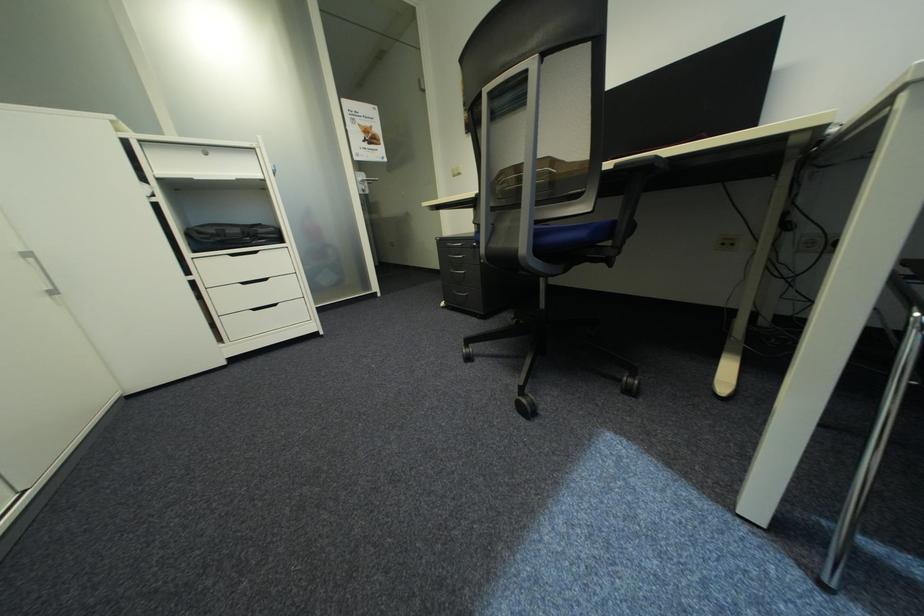
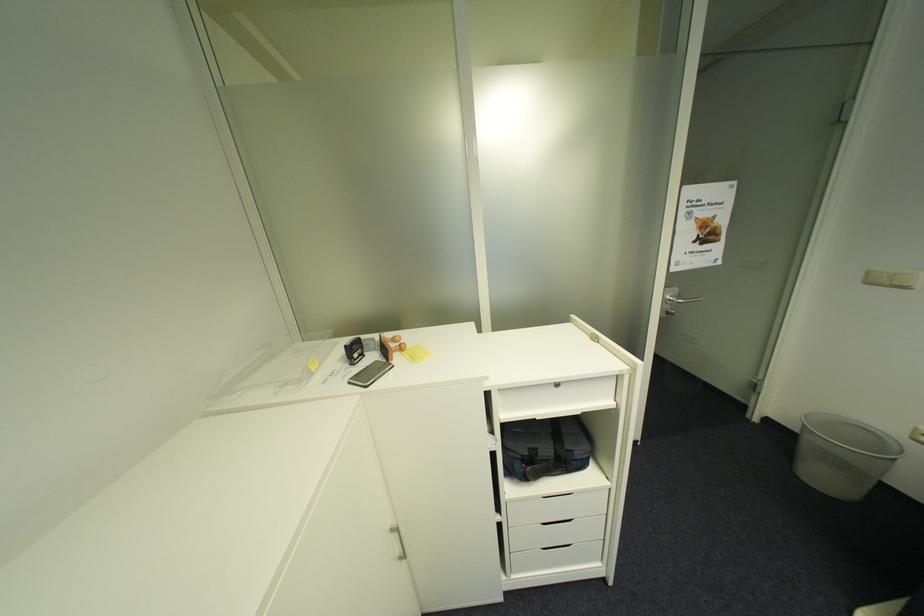
The point at (369, 182) is marked in the first image. Where is the corresponding point in the second image?

(676, 301)